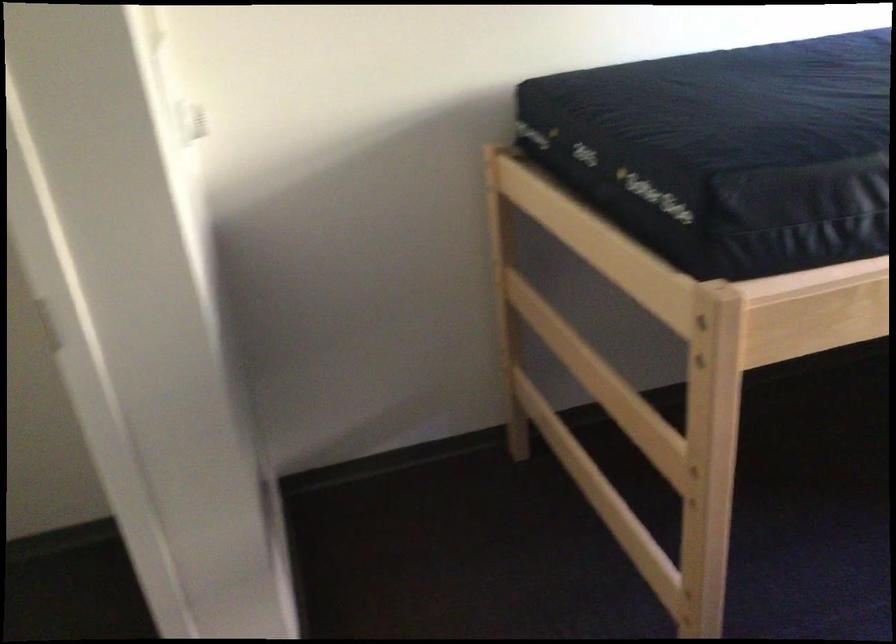
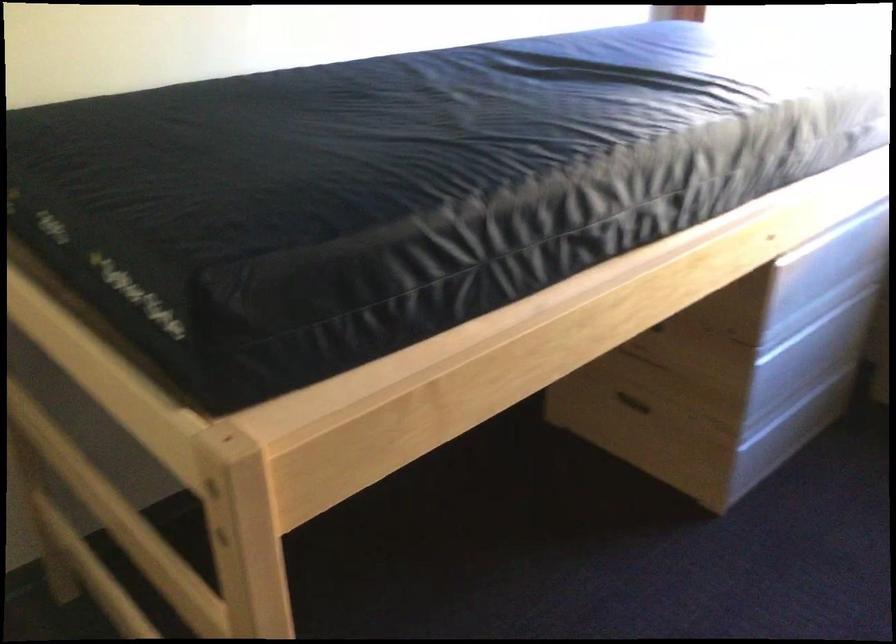
Find the pixel in the second image that matches (x=729, y=118) in the first image.

(237, 183)